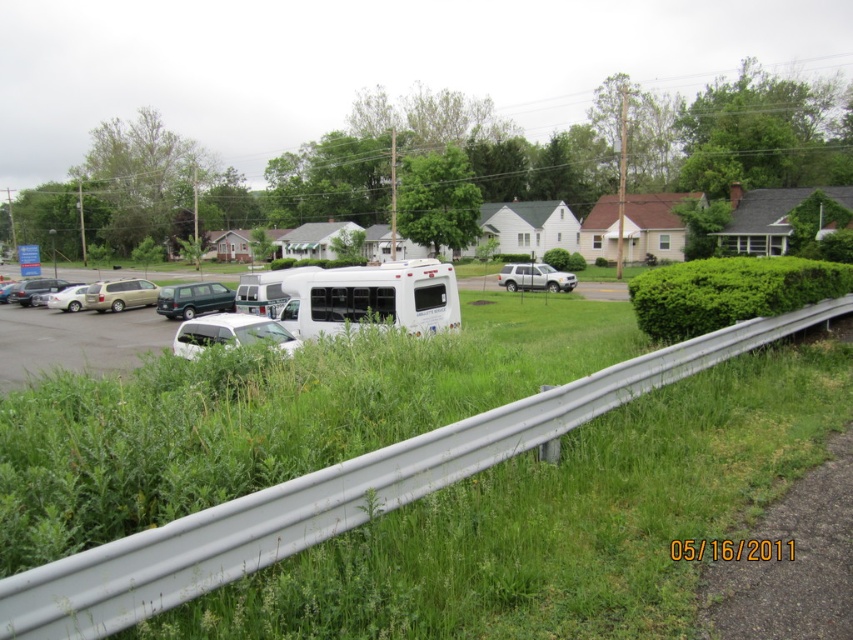
Question: Is metallic green minivan at left thinner than beige matte minivan at left?

Choices:
 (A) no
 (B) yes

Answer: (A)

Question: Which object is closer to the camera taking this photo?

Choices:
 (A) green leafy hedge at center
 (B) beige matte minivan at left
 (C) metallic green minivan at left
 (D) silver metallic sedan at left

Answer: (A)

Question: Does white matte bus at center appear on the right side of white matte car at center?

Choices:
 (A) yes
 (B) no

Answer: (A)

Question: Among these points, which one is nearest to the camera?

Choices:
 (A) (579, 392)
 (B) (558, 278)
 (C) (178, 314)
 (D) (16, 362)

Answer: (A)

Question: Which point appears farthest from the camera in this image?

Choices:
 (A) (120, 307)
 (B) (65, 296)
 (C) (209, 304)
 (D) (212, 340)

Answer: (B)

Question: Does silver metallic suv at center have a smaller size compared to matte silver sedan at left?

Choices:
 (A) no
 (B) yes

Answer: (A)